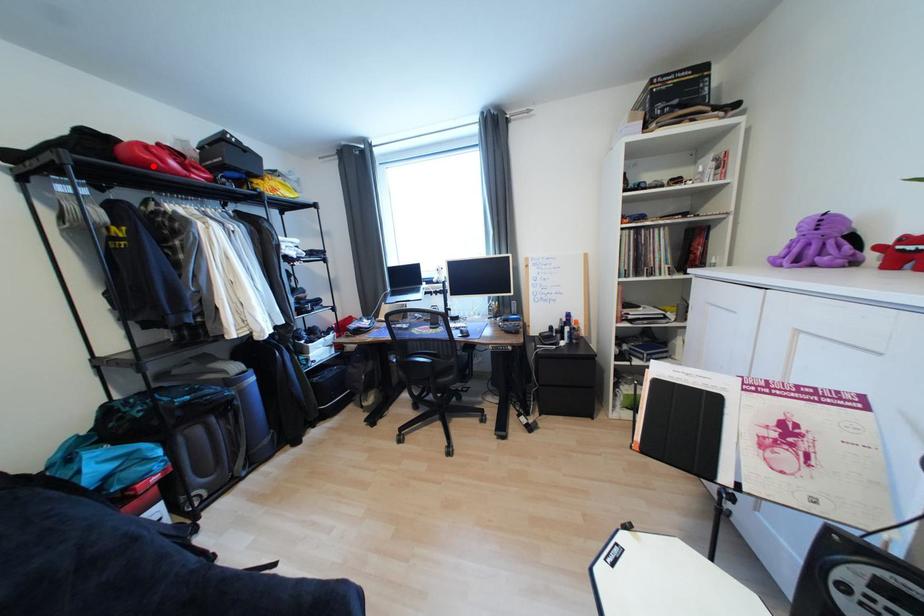
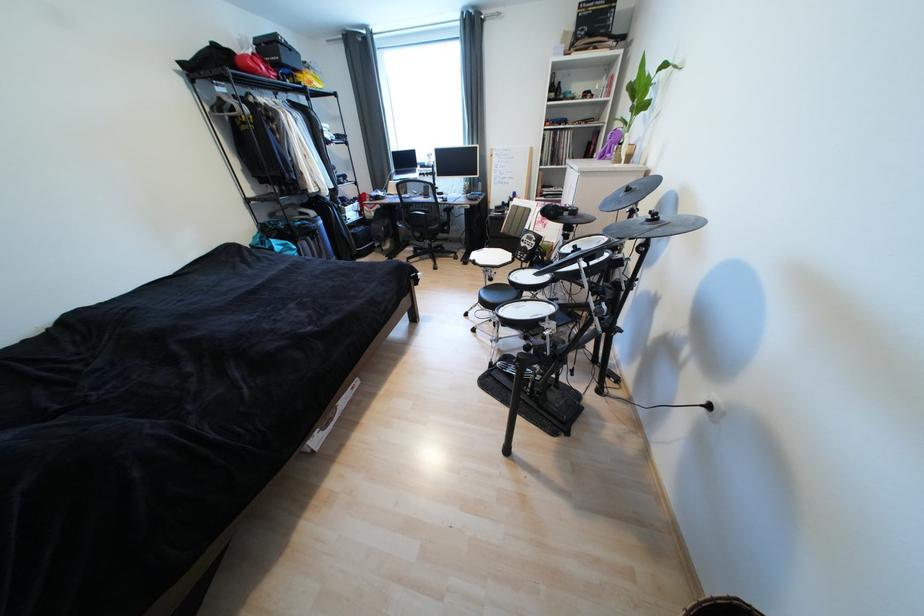
The point at the highlighted location is marked in the first image. Where is the corresponding point in the second image?

(261, 73)